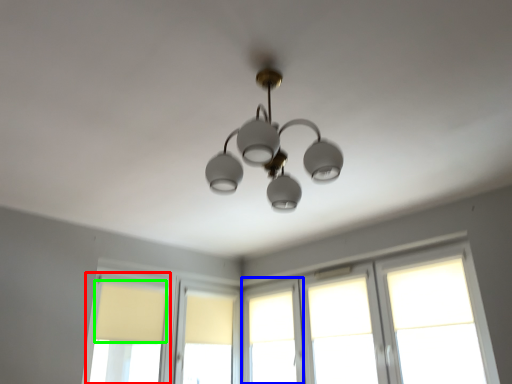
Question: Considering the real-world distances, which object is farthest from window (highlighted by a red box)? window (highlighted by a blue box) or curtain (highlighted by a green box)?

Choices:
 (A) window
 (B) curtain

Answer: (A)